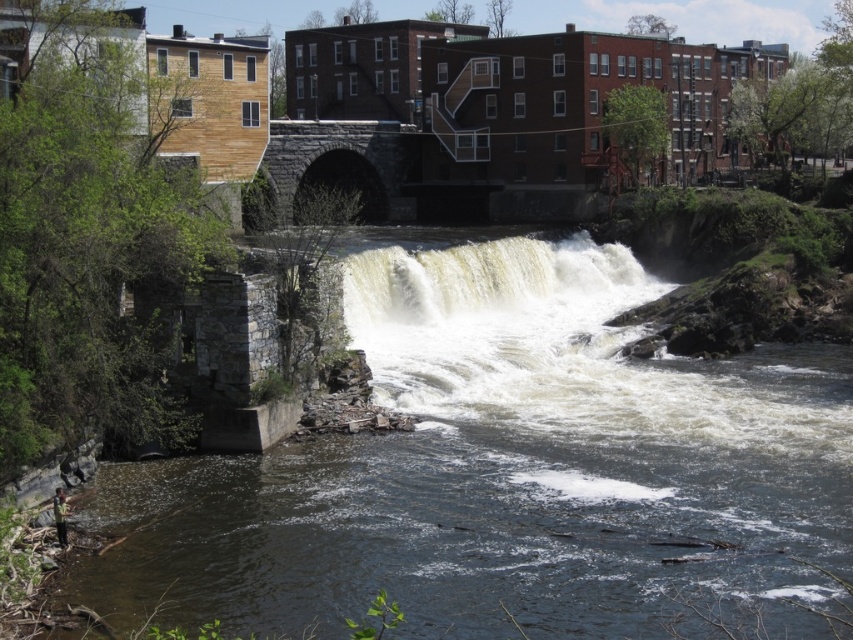
Between dark gray concrete river at lower left and white frothy water at center, which one has more height?

With more height is dark gray concrete river at lower left.

Can you confirm if dark gray concrete river at lower left is positioned above white frothy water at center?

No.

Measure the distance between dark gray concrete river at lower left and camera.

dark gray concrete river at lower left and camera are 31.74 meters apart.

Where is `dark gray concrete river at lower left`? dark gray concrete river at lower left is located at coordinates (503, 468).